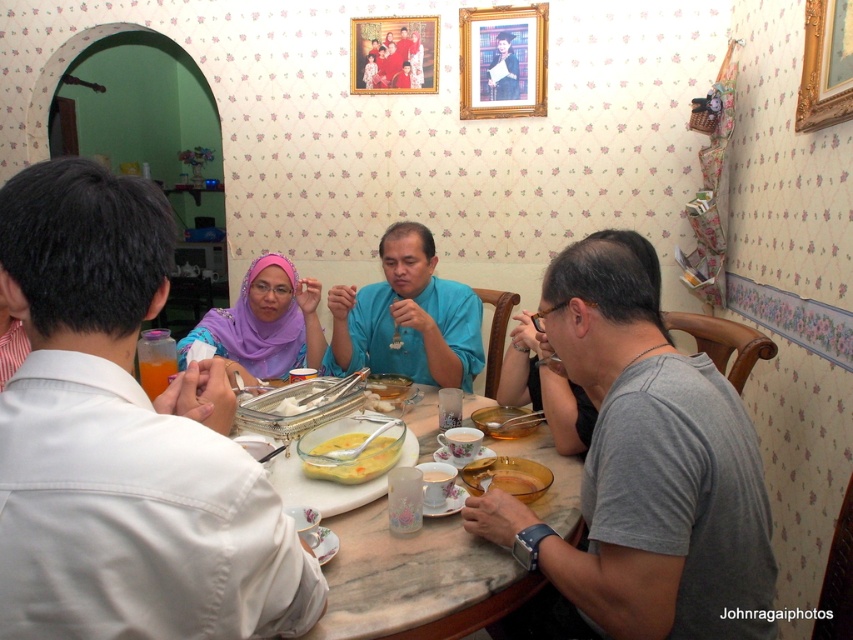
Does white cotton shirt at upper left have a smaller size compared to matte plastic bowl at center?

Indeed, white cotton shirt at upper left has a smaller size compared to matte plastic bowl at center.

This screenshot has height=640, width=853. What do you see at coordinates (123, 440) in the screenshot?
I see `white cotton shirt at upper left` at bounding box center [123, 440].

Who is more forward, [161,522] or [115,324]?

Point [161,522] is in front.

Find the location of a particular element. white cotton shirt at upper left is located at coordinates (123, 440).

Measure the distance between point (509, 33) and camera.

3.15 meters

Does gold wooden picture frame at upper center have a smaller size compared to matte blue shirt at center?

Actually, gold wooden picture frame at upper center might be larger than matte blue shirt at center.

Locate an element on the screen. This screenshot has width=853, height=640. gold wooden picture frame at upper center is located at coordinates (503, 61).

Between matte plastic bowl at center and gold ornate picture frame at upper right, which one appears on the right side from the viewer's perspective?

gold ornate picture frame at upper right is more to the right.

Which is behind, point (83, 474) or point (805, 108)?

Point (805, 108)

Find the location of a particular element. The width and height of the screenshot is (853, 640). matte plastic bowl at center is located at coordinates (123, 440).